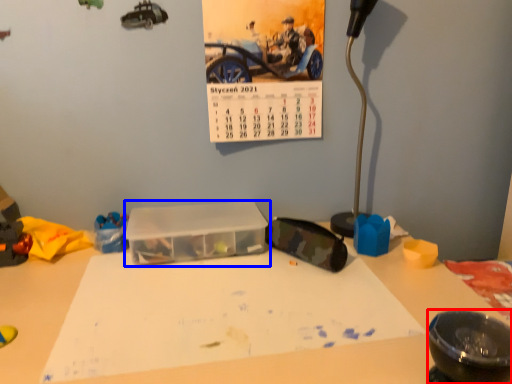
Question: Which object appears farthest to the camera in this image, bowl (highlighted by a red box) or glass box (highlighted by a blue box)?

Choices:
 (A) bowl
 (B) glass box

Answer: (B)